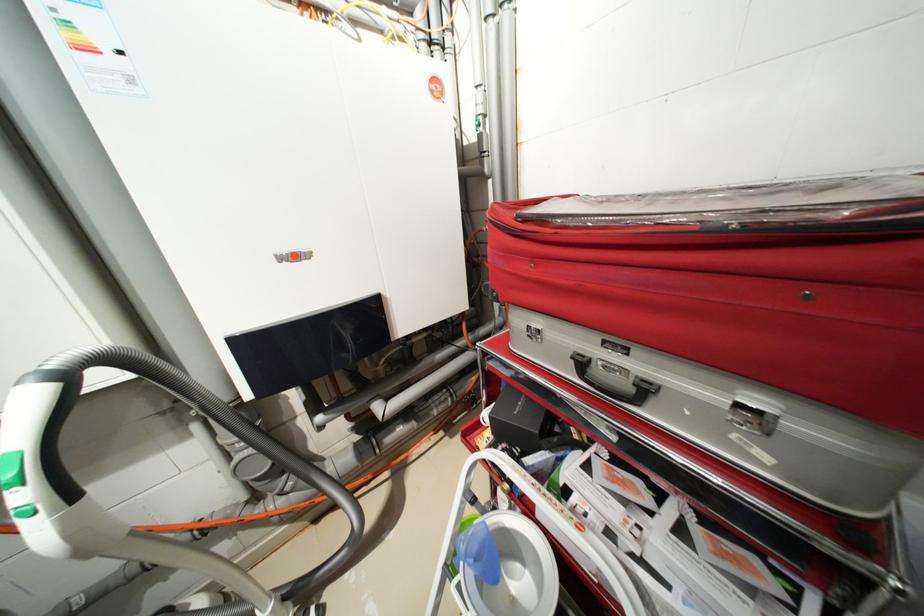
Where would you lift the silver case handle? Please return your answer as a coordinate pair (x, y).

(613, 379)